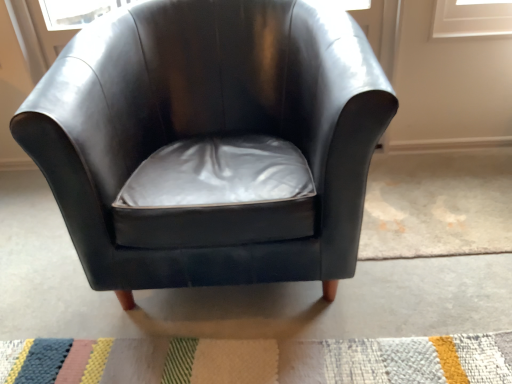
This screenshot has width=512, height=384. In order to click on blank space situated above multicolored woven mat at lower center (from a real-world perspective) in this screenshot , I will do `click(219, 360)`.